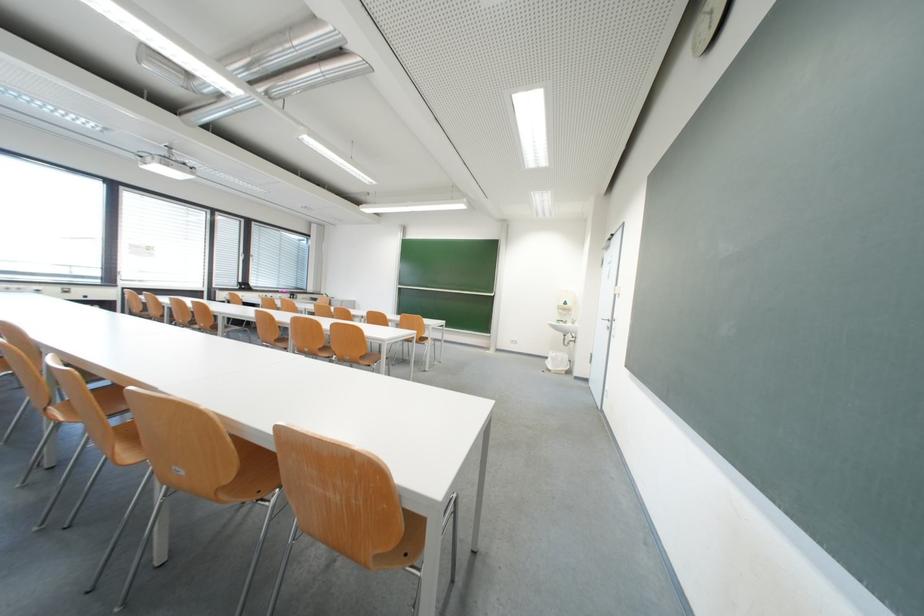
Find the location of `white trash can`. white trash can is located at coordinates (556, 362).